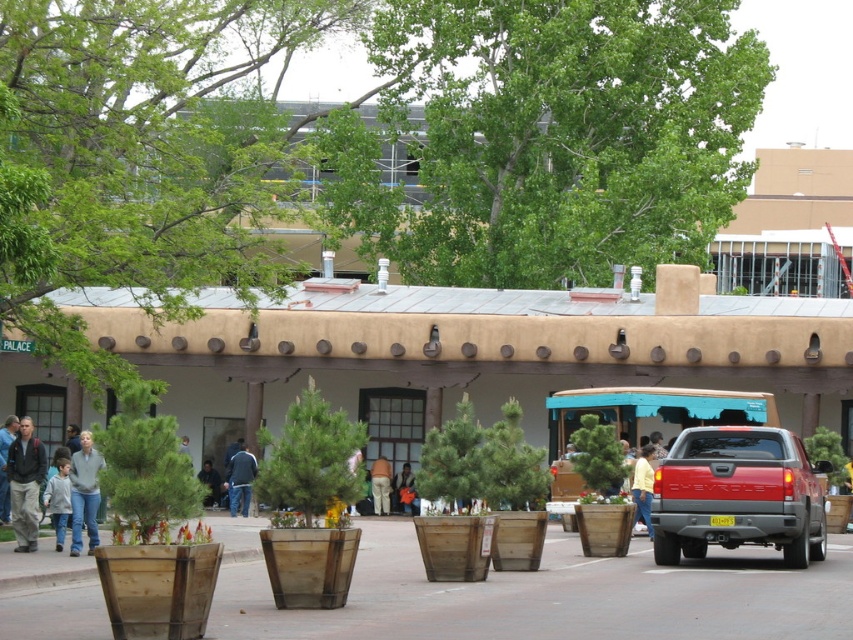
Between red matte truck at center right and light gray sweater at lower left, which one has less height?

light gray sweater at lower left

Can you confirm if red matte truck at center right is positioned to the right of light gray sweater at lower left?

Yes, red matte truck at center right is to the right of light gray sweater at lower left.

Who is more forward, [822,500] or [57,532]?

Point [57,532] is in front.

This screenshot has height=640, width=853. I want to click on red matte truck at center right, so click(x=738, y=493).

The image size is (853, 640). What do you see at coordinates (480, 349) in the screenshot?
I see `smooth concrete plaza at center` at bounding box center [480, 349].

Is smooth concrete plaza at center above red matte truck at center right?

Correct, smooth concrete plaza at center is located above red matte truck at center right.

Where is `smooth concrete plaza at center`? The image size is (853, 640). smooth concrete plaza at center is located at coordinates (480, 349).

In order to click on smooth concrete plaza at center in this screenshot , I will do `click(480, 349)`.

Between point (665, 115) and point (401, 502), which one is positioned in front?

Point (401, 502) is more forward.

Does green leafy tree at upper center have a greater width compared to orange fabric bag at center?

Indeed, green leafy tree at upper center has a greater width compared to orange fabric bag at center.

Which is in front, point (483, 186) or point (404, 486)?

Positioned in front is point (404, 486).

At what (x,y) coordinates should I click in order to perform the action: click on green leafy tree at upper center. Please return your answer as a coordinate pair (x, y). Looking at the image, I should click on (567, 132).